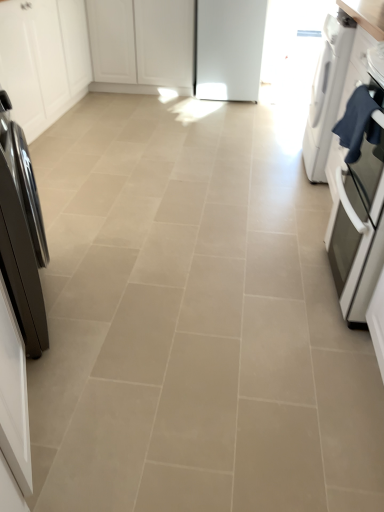
This screenshot has width=384, height=512. In order to click on free space in front of matte stainless steel oven at right in this screenshot , I will do `click(330, 358)`.